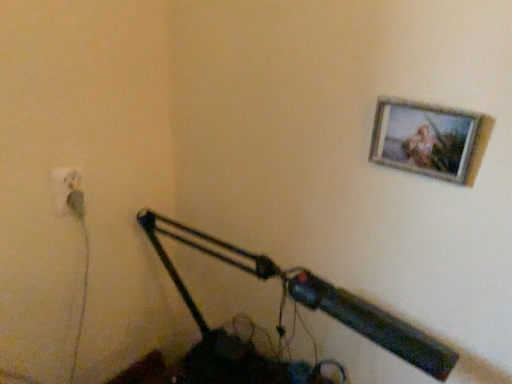
Measure the distance between point (355, 327) and camera.

A distance of 28.86 inches exists between point (355, 327) and camera.

You are a GUI agent. You are given a task and a screenshot of the screen. Output one action in this format:
    pyautogui.click(x=<x>, y=<y>)
    Task: Click on the white plastic electric outlet at lower left
    The image size is (512, 384).
    Given the screenshot: What is the action you would take?
    pyautogui.click(x=68, y=191)

Find the location of a particular element. The height and width of the screenshot is (384, 512). picture frame on the right of white plastic electric outlet at lower left is located at coordinates (424, 139).

Can you confirm if wooden frame at upper right is thinner than white plastic electric outlet at lower left?

No.

What's the angular difference between wooden frame at upper right and white plastic electric outlet at lower left's facing directions?

The angle between the facing direction of wooden frame at upper right and the facing direction of white plastic electric outlet at lower left is 86.3 degrees.

Is wooden frame at upper right positioned far away from white plastic electric outlet at lower left?

They are positioned close to each other.

Which point is more distant from viewer, (54,185) or (408,105)?

The point (54,185) is behind.

Consider the image. Are white plastic electric outlet at lower left and wooden frame at upper right beside each other?

white plastic electric outlet at lower left and wooden frame at upper right are clearly separated.

From a real-world perspective, is white plastic electric outlet at lower left under wooden frame at upper right?

Yes, from a real-world perspective, white plastic electric outlet at lower left is below wooden frame at upper right.

Considering the positions of objects white plastic electric outlet at lower left and wooden frame at upper right in the image provided, who is in front, white plastic electric outlet at lower left or wooden frame at upper right?

wooden frame at upper right.

Does white plastic electric outlet at lower left have a larger size compared to green rubber plug at lower left?

Correct, white plastic electric outlet at lower left is larger in size than green rubber plug at lower left.

From the image's perspective, is white plastic electric outlet at lower left located above or below green rubber plug at lower left?

From the image's perspective, white plastic electric outlet at lower left appears above green rubber plug at lower left.

How distant is white plastic electric outlet at lower left from green rubber plug at lower left?

white plastic electric outlet at lower left is 0.60 inches from green rubber plug at lower left.

Is white plastic electric outlet at lower left turned away from green rubber plug at lower left?

Correct, white plastic electric outlet at lower left is looking away from green rubber plug at lower left.

How different are the orientations of metallic black lamp at lower center and wooden frame at upper right in degrees?

The angle between the facing direction of metallic black lamp at lower center and the facing direction of wooden frame at upper right is 0.993 degrees.

From the image's perspective, which one is positioned higher, metallic black lamp at lower center or wooden frame at upper right?

wooden frame at upper right appears higher in the image.

Is point (404, 340) positioned in front of point (399, 145)?

Yes, point (404, 340) is in front of point (399, 145).

Does metallic black lamp at lower center have a larger size compared to wooden frame at upper right?

Indeed, metallic black lamp at lower center has a larger size compared to wooden frame at upper right.

Locate an element on the screen. lamp in front of the green rubber plug at lower left is located at coordinates coord(283,327).

Would you say green rubber plug at lower left contains metallic black lamp at lower center?

No, metallic black lamp at lower center is not surrounded by green rubber plug at lower left.

Does green rubber plug at lower left turn towards metallic black lamp at lower center?

No, green rubber plug at lower left is not facing towards metallic black lamp at lower center.

From the image's perspective, between green rubber plug at lower left and metallic black lamp at lower center, who is located below?

From the image's view, metallic black lamp at lower center is below.

Which object is positioned more to the right, green rubber plug at lower left or wooden frame at upper right?

From the viewer's perspective, wooden frame at upper right appears more on the right side.

Is green rubber plug at lower left located outside wooden frame at upper right?

green rubber plug at lower left lies outside wooden frame at upper right's area.

From the image's perspective, is green rubber plug at lower left above or below wooden frame at upper right?

green rubber plug at lower left is below wooden frame at upper right.

Considering the relative sizes of green rubber plug at lower left and wooden frame at upper right in the image provided, is green rubber plug at lower left wider than wooden frame at upper right?

Yes, green rubber plug at lower left is wider than wooden frame at upper right.

From the image's perspective, which one is positioned higher, metallic black lamp at lower center or white plastic electric outlet at lower left?

From the image's view, white plastic electric outlet at lower left is above.

Between metallic black lamp at lower center and white plastic electric outlet at lower left, which one has smaller size?

white plastic electric outlet at lower left is smaller.

Which of these two, metallic black lamp at lower center or white plastic electric outlet at lower left, is thinner?

Thinner between the two is white plastic electric outlet at lower left.

Does metallic black lamp at lower center contain white plastic electric outlet at lower left?

No, white plastic electric outlet at lower left is not inside metallic black lamp at lower center.

Locate an element on the screen. This screenshot has width=512, height=384. electric outlet below the wooden frame at upper right (from the image's perspective) is located at coordinates (68, 191).

At what (x,y) coordinates should I click in order to perform the action: click on electric outlet on the left of wooden frame at upper right. Please return your answer as a coordinate pair (x, y). Image resolution: width=512 pixels, height=384 pixels. Looking at the image, I should click on (68, 191).

Which object lies nearer to the anchor point green rubber plug at lower left, wooden frame at upper right or metallic black lamp at lower center?

Based on the image, metallic black lamp at lower center appears to be nearer to green rubber plug at lower left.

Considering their positions, is green rubber plug at lower left positioned closer to metallic black lamp at lower center than wooden frame at upper right?

The object closer to metallic black lamp at lower center is wooden frame at upper right.

Considering their positions, is metallic black lamp at lower center positioned closer to white plastic electric outlet at lower left than green rubber plug at lower left?

green rubber plug at lower left lies closer to white plastic electric outlet at lower left than the other object.

Looking at the image, which one is located further to white plastic electric outlet at lower left, green rubber plug at lower left or wooden frame at upper right?

wooden frame at upper right is further to white plastic electric outlet at lower left.

Which object lies further to the anchor point wooden frame at upper right, white plastic electric outlet at lower left or green rubber plug at lower left?

Among the two, green rubber plug at lower left is located further to wooden frame at upper right.

Looking at the image, which one is located closer to wooden frame at upper right, green rubber plug at lower left or white plastic electric outlet at lower left?

white plastic electric outlet at lower left is closer to wooden frame at upper right.

Consider the image. When comparing their distances from white plastic electric outlet at lower left, does green rubber plug at lower left or metallic black lamp at lower center seem closer?

green rubber plug at lower left is positioned closer to the anchor white plastic electric outlet at lower left.

Which object lies nearer to the anchor point wooden frame at upper right, green rubber plug at lower left or metallic black lamp at lower center?

The object closer to wooden frame at upper right is metallic black lamp at lower center.

You are a GUI agent. You are given a task and a screenshot of the screen. Output one action in this format:
    pyautogui.click(x=<x>, y=<y>)
    Task: Click on the lamp between green rubber plug at lower left and wooden frame at upper right from left to right
    
    Given the screenshot: What is the action you would take?
    pyautogui.click(x=283, y=327)

Identify the location of plug located between white plastic electric outlet at lower left and wooden frame at upper right in the left-right direction. (76, 203).

Find the location of a particular element. The width and height of the screenshot is (512, 384). plug situated between white plastic electric outlet at lower left and metallic black lamp at lower center from left to right is located at coordinates (76, 203).

Identify the location of lamp between white plastic electric outlet at lower left and wooden frame at upper right from left to right. (283, 327).